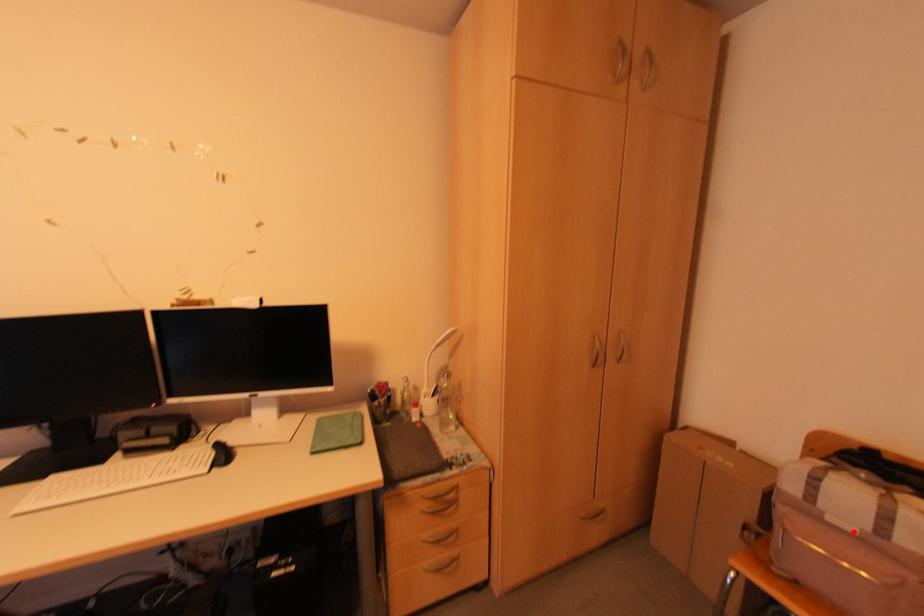
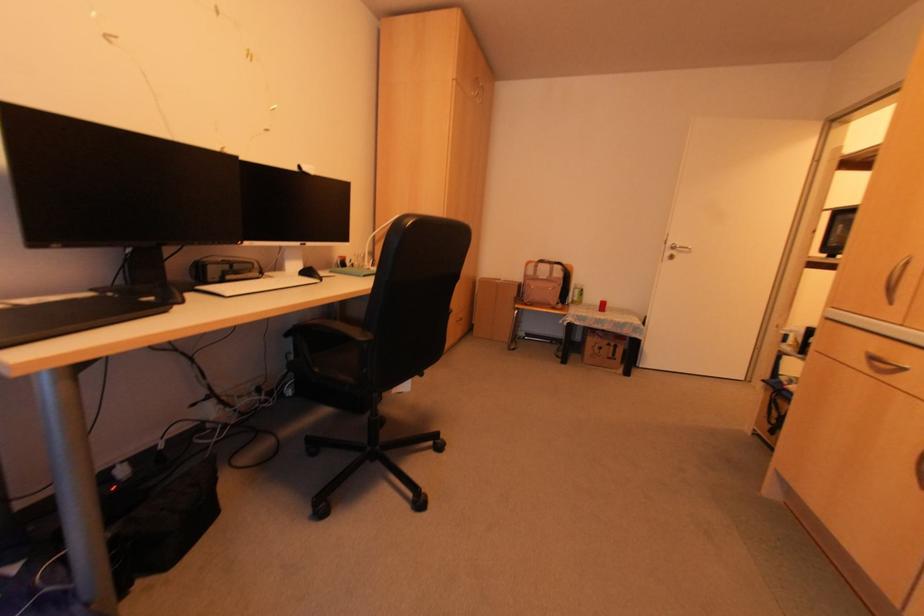
Question: I am providing you with two images of the same scene from different viewpoints. A red point is marked on the first image. At the location where the point appears in image 1, is it still visible in image 2?

Choices:
 (A) Yes
 (B) No

Answer: (A)